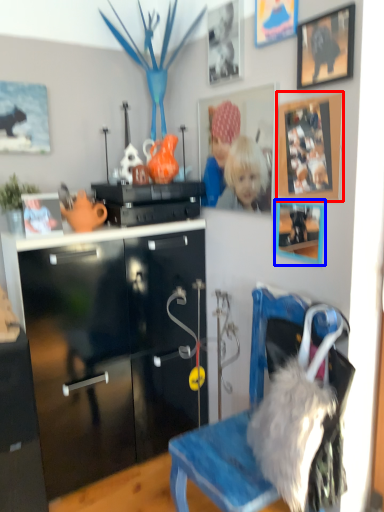
Question: Which object is further to the camera taking this photo, picture frame (highlighted by a red box) or picture frame (highlighted by a blue box)?

Choices:
 (A) picture frame
 (B) picture frame

Answer: (B)